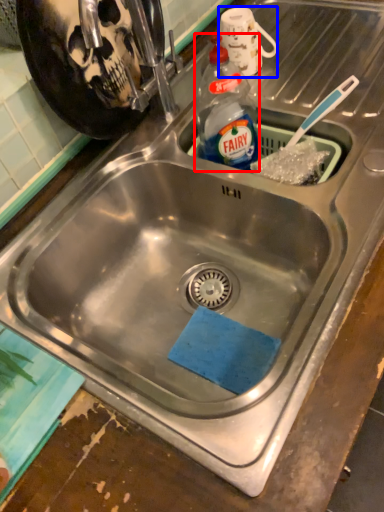
Question: Which of the following is the closest to the observer, bottle (highlighted by a red box) or mug (highlighted by a blue box)?

Choices:
 (A) bottle
 (B) mug

Answer: (A)